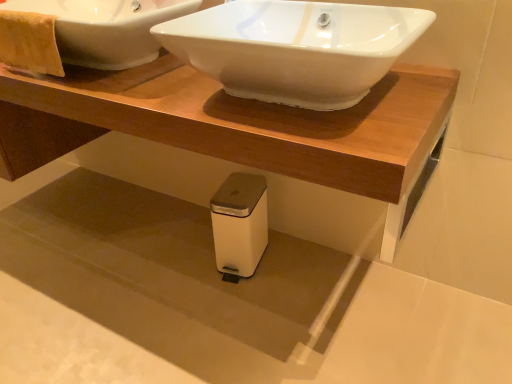
Question: Considering the relative sizes of yellow textured towel at upper left and white matte trash can at lower center in the image provided, is yellow textured towel at upper left wider than white matte trash can at lower center?

Choices:
 (A) yes
 (B) no

Answer: (B)

Question: From the image's perspective, is yellow textured towel at upper left below white matte trash can at lower center?

Choices:
 (A) yes
 (B) no

Answer: (B)

Question: Does yellow textured towel at upper left come behind white matte trash can at lower center?

Choices:
 (A) yes
 (B) no

Answer: (B)

Question: Does yellow textured towel at upper left have a smaller size compared to white matte trash can at lower center?

Choices:
 (A) yes
 (B) no

Answer: (A)

Question: Is yellow textured towel at upper left facing towards white matte trash can at lower center?

Choices:
 (A) yes
 (B) no

Answer: (B)

Question: Considering the positions of yellow textured towel at upper left and white plastic trash can at lower center in the image, is yellow textured towel at upper left bigger or smaller than white plastic trash can at lower center?

Choices:
 (A) small
 (B) big

Answer: (A)

Question: From the image's perspective, relative to white plastic trash can at lower center, is yellow textured towel at upper left above or below?

Choices:
 (A) above
 (B) below

Answer: (A)

Question: Is yellow textured towel at upper left inside the boundaries of white plastic trash can at lower center, or outside?

Choices:
 (A) inside
 (B) outside

Answer: (B)

Question: Relative to white plastic trash can at lower center, is yellow textured towel at upper left in front or behind?

Choices:
 (A) behind
 (B) front

Answer: (A)

Question: From a real-world perspective, is white matte trash can at lower center positioned above or below white glossy sink at upper center, which is the 2th sink from right to left?

Choices:
 (A) above
 (B) below

Answer: (B)

Question: Based on their positions, is white matte trash can at lower center located to the left or right of white glossy sink at upper center, which is the 2th sink from right to left?

Choices:
 (A) left
 (B) right

Answer: (B)

Question: Is white matte trash can at lower center inside or outside of white glossy sink at upper center, acting as the 1th sink starting from the left?

Choices:
 (A) inside
 (B) outside

Answer: (B)

Question: Considering the positions of white matte trash can at lower center and white glossy sink at upper center, which is the 2th sink from right to left, in the image, is white matte trash can at lower center wider or thinner than white glossy sink at upper center, which is the 2th sink from right to left,?

Choices:
 (A) thin
 (B) wide

Answer: (A)

Question: In terms of size, does white glossy sink at upper center, placed as the second sink when sorted from left to right, appear bigger or smaller than yellow textured towel at upper left?

Choices:
 (A) small
 (B) big

Answer: (B)

Question: Considering their positions, is white glossy sink at upper center, placed as the second sink when sorted from left to right, located in front of or behind yellow textured towel at upper left?

Choices:
 (A) front
 (B) behind

Answer: (A)